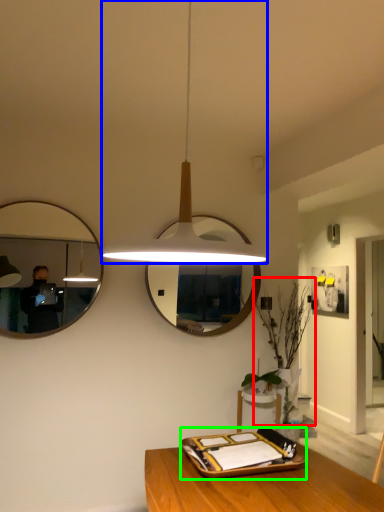
Question: Based on their relative distances, which object is farther from plant (highlighted by a red box)? Choose from lamp (highlighted by a blue box) and tray (highlighted by a green box).

Choices:
 (A) lamp
 (B) tray

Answer: (A)